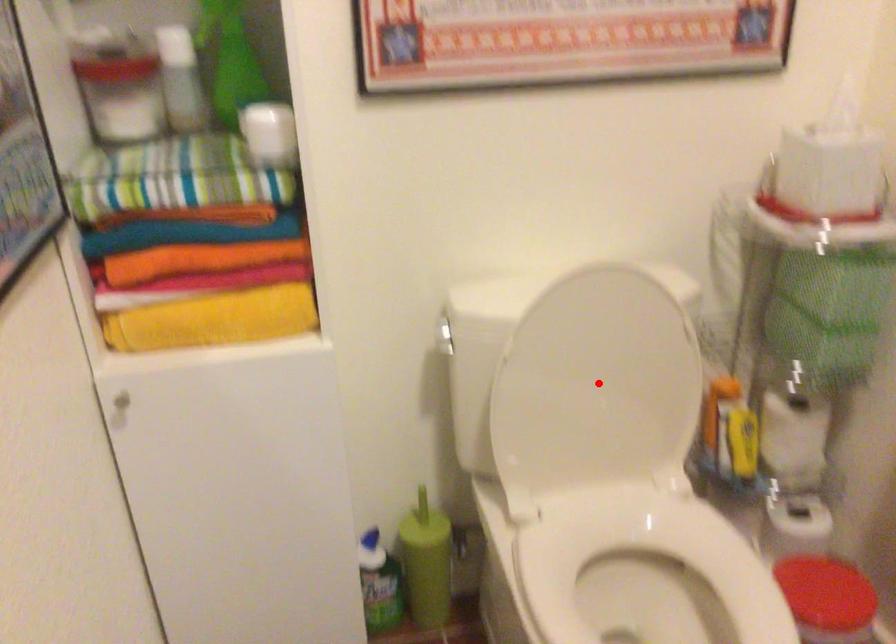
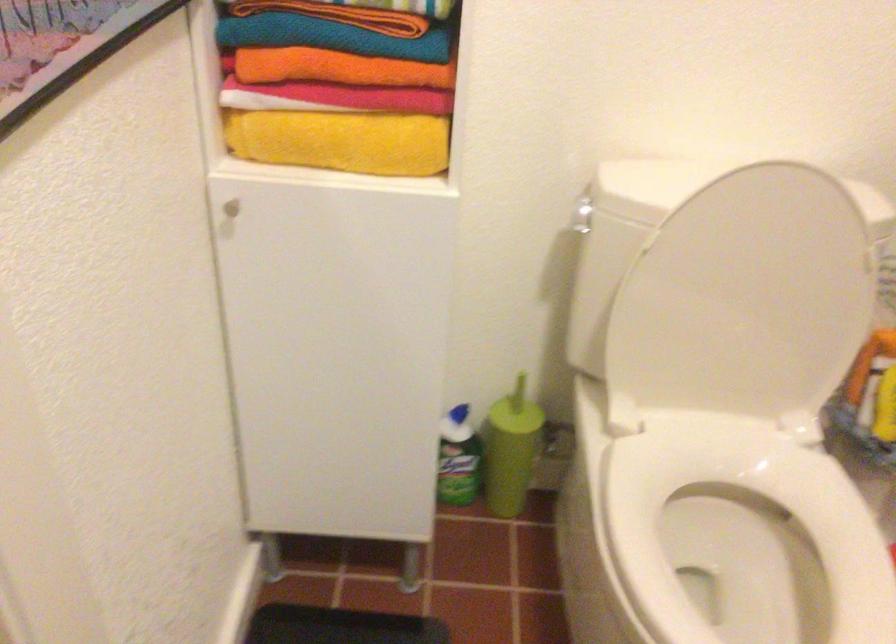
Question: A red point is marked in image1. In image2, is the corresponding 3D point closer to the camera or farther? Reply with the corresponding letter.

Choices:
 (A) The corresponding 3D point is closer.
 (B) The corresponding 3D point is farther.

Answer: (A)